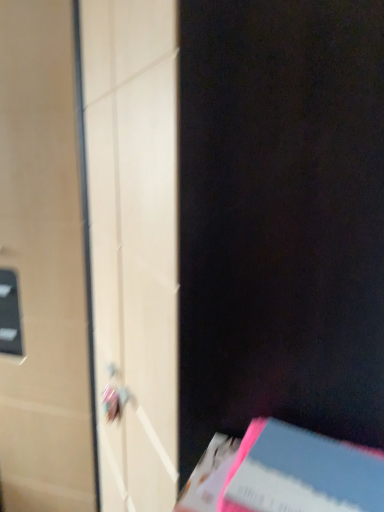
Identify the location of pink matte paper at lower right. (302, 473).

The height and width of the screenshot is (512, 384). What do you see at coordinates (302, 473) in the screenshot?
I see `pink matte paper at lower right` at bounding box center [302, 473].

In order to face pink matte paper at lower right, should I rotate leftwards or rightwards?

You should look right and rotate roughly 20.318 degrees.

What do you see at coordinates (44, 265) in the screenshot? I see `matte white door at left` at bounding box center [44, 265].

In the scene shown: What is the approximate width of matte white door at left?

It is 17.11 inches.

Image resolution: width=384 pixels, height=512 pixels. What are the coordinates of `matte white door at left` in the screenshot? It's located at pyautogui.click(x=44, y=265).

Locate an element on the screen. Image resolution: width=384 pixels, height=512 pixels. pink matte paper at lower right is located at coordinates (302, 473).

Based on their positions, is pink matte paper at lower right located to the left or right of matte white door at left?

pink matte paper at lower right is to the right of matte white door at left.

Considering the positions of objects pink matte paper at lower right and matte white door at left in the image provided, who is in front, pink matte paper at lower right or matte white door at left?

pink matte paper at lower right is in front.

Does point (361, 500) appear closer or farther from the camera than point (6, 498)?

Point (361, 500).

From the image's perspective, is pink matte paper at lower right on top of matte white door at left?

Actually, pink matte paper at lower right appears below matte white door at left in the image.

From a real-world perspective, who is located lower, pink matte paper at lower right or matte white door at left?

From a 3D spatial view, matte white door at left is below.

Considering the sizes of pink matte paper at lower right and matte white door at left in the image, is pink matte paper at lower right wider or thinner than matte white door at left?

Considering their sizes, pink matte paper at lower right looks slimmer than matte white door at left.

Considering the relative sizes of pink matte paper at lower right and matte white door at left in the image provided, is pink matte paper at lower right shorter than matte white door at left?

Indeed, pink matte paper at lower right has a lesser height compared to matte white door at left.

Is pink matte paper at lower right bigger or smaller than matte white door at left?

In the image, pink matte paper at lower right appears to be smaller than matte white door at left.

Would you say pink matte paper at lower right contains matte white door at left?

No, matte white door at left is not inside pink matte paper at lower right.

Are pink matte paper at lower right and matte white door at left far apart?

Indeed, pink matte paper at lower right is not near matte white door at left.

From the picture: Could you tell me if pink matte paper at lower right is facing matte white door at left?

No, pink matte paper at lower right is not aimed at matte white door at left.

What's the angular difference between pink matte paper at lower right and matte white door at left's facing directions?

The angular difference between pink matte paper at lower right and matte white door at left is 94.2 degrees.

Measure the distance from pink matte paper at lower right to matte white door at left.

pink matte paper at lower right and matte white door at left are 1.05 meters apart from each other.

Find the location of `door located behind the pink matte paper at lower right`. door located behind the pink matte paper at lower right is located at coordinates (44, 265).

In the scene shown: Between matte white door at left and pink matte paper at lower right, which one appears on the left side from the viewer's perspective?

Positioned to the left is matte white door at left.

Considering the positions of objects matte white door at left and pink matte paper at lower right in the image provided, who is in front, matte white door at left or pink matte paper at lower right?

pink matte paper at lower right is closer to the camera.

Does point (19, 88) come behind point (340, 468)?

Yes.

From the image's perspective, which one is positioned lower, matte white door at left or pink matte paper at lower right?

pink matte paper at lower right.

From a real-world perspective, is matte white door at left on pink matte paper at lower right?

No, from a real-world perspective, matte white door at left is not on top of pink matte paper at lower right.

Can you confirm if matte white door at left is thinner than pink matte paper at lower right?

No, matte white door at left is not thinner than pink matte paper at lower right.

From their relative heights in the image, would you say matte white door at left is taller or shorter than pink matte paper at lower right?

In the image, matte white door at left appears to be taller than pink matte paper at lower right.

Based on their sizes in the image, would you say matte white door at left is bigger or smaller than pink matte paper at lower right?

Clearly, matte white door at left is larger in size than pink matte paper at lower right.

Is pink matte paper at lower right located within matte white door at left?

Actually, pink matte paper at lower right is outside matte white door at left.

Is matte white door at left not near pink matte paper at lower right?

Yes, matte white door at left and pink matte paper at lower right are quite far apart.

Is matte white door at left oriented towards pink matte paper at lower right?

No, matte white door at left is not facing towards pink matte paper at lower right.

Can you tell me how much matte white door at left and pink matte paper at lower right differ in facing direction?

There is a 94.2-degree angle between the facing directions of matte white door at left and pink matte paper at lower right.

The width and height of the screenshot is (384, 512). Find the location of `paperback book on the right of matte white door at left`. paperback book on the right of matte white door at left is located at coordinates (302, 473).

This screenshot has width=384, height=512. Identify the location of door lying above the pink matte paper at lower right (from the image's perspective). (44, 265).

Find the location of a particular element. door on the left of pink matte paper at lower right is located at coordinates (44, 265).